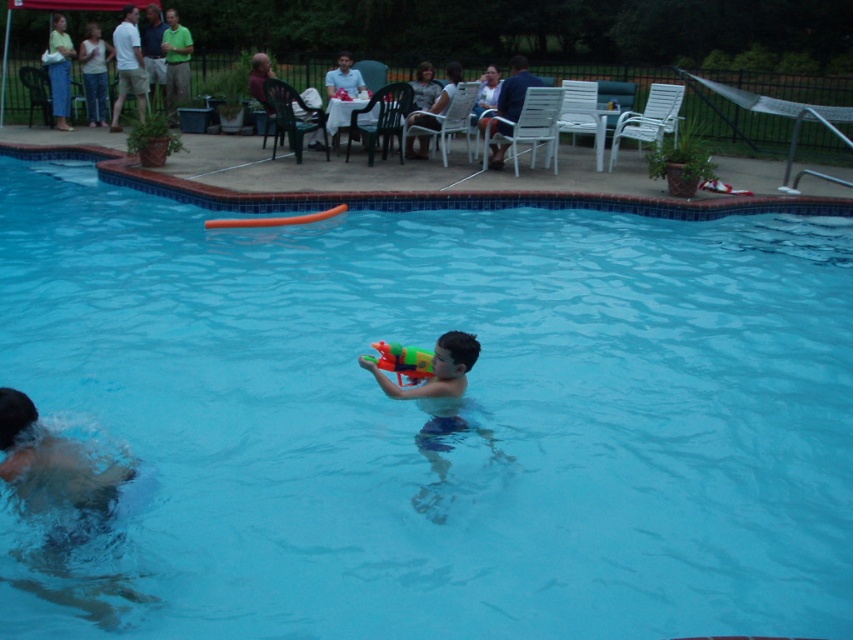
Between point (260, 51) and point (358, 74), which one is positioned behind?

The point (260, 51) is more distant.

Does dark red fabric chair at upper center come behind smooth white shirt at upper center?

No, it is not.

Which is in front, point (316, 141) or point (332, 96)?

Point (332, 96) is in front.

I want to click on dark red fabric chair at upper center, so click(260, 80).

Is green matte shirt at upper center above gray fabric shirt at upper center?

Indeed, green matte shirt at upper center is positioned over gray fabric shirt at upper center.

From the picture: Can you confirm if green matte shirt at upper center is positioned to the right of gray fabric shirt at upper center?

In fact, green matte shirt at upper center is to the left of gray fabric shirt at upper center.

Measure the distance between point (183, 65) and camera.

Point (183, 65) is 48.64 feet away from camera.

You are a GUI agent. You are given a task and a screenshot of the screen. Output one action in this format:
    pyautogui.click(x=<x>, y=<y>)
    Task: Click on the green matte shirt at upper center
    The width and height of the screenshot is (853, 640).
    Given the screenshot: What is the action you would take?
    pyautogui.click(x=175, y=64)

Between blue denim shorts at center and smooth white shirt at upper center, which one appears on the right side from the viewer's perspective?

blue denim shorts at center

What do you see at coordinates (509, 99) in the screenshot? Image resolution: width=853 pixels, height=640 pixels. I see `blue denim shorts at center` at bounding box center [509, 99].

Does point (490, 163) come behind point (349, 76)?

No, it is in front of (349, 76).

Find the location of a particular element. The height and width of the screenshot is (640, 853). blue denim shorts at center is located at coordinates (509, 99).